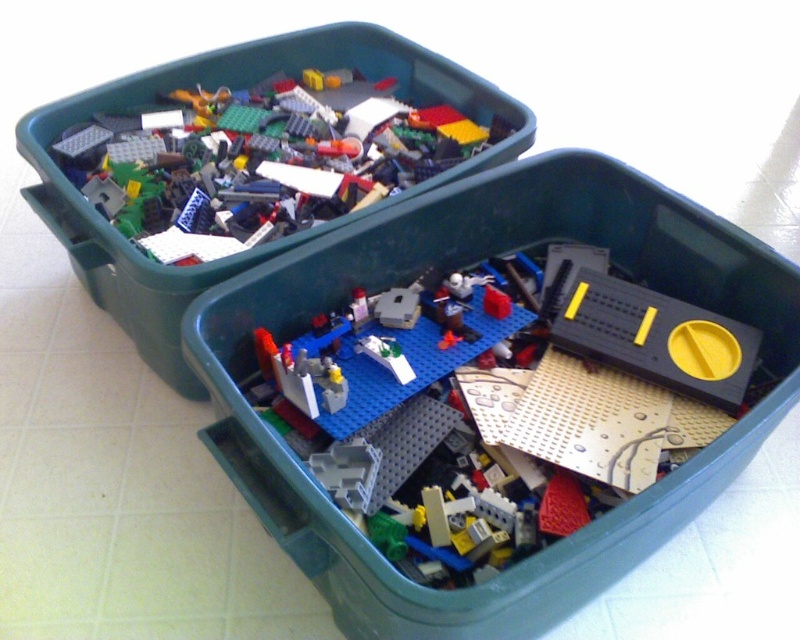
Does blue plastic baseplate at center appear on the left side of matte plastic lego bricks at upper left?

No, blue plastic baseplate at center is not to the left of matte plastic lego bricks at upper left.

This screenshot has width=800, height=640. I want to click on blue plastic baseplate at center, so [x=500, y=408].

Where is `blue plastic baseplate at center`? This screenshot has height=640, width=800. blue plastic baseplate at center is located at coordinates (500, 408).

The height and width of the screenshot is (640, 800). I want to click on blue plastic baseplate at center, so click(500, 408).

Who is more distant from viewer, (x=314, y=115) or (x=440, y=58)?

The point (x=314, y=115) is behind.

From the picture: Who is lower down, translucent plastic bricks at upper left or matte plastic lego bricks at upper left?

Positioned lower is matte plastic lego bricks at upper left.

Is point (380, 154) less distant than point (165, 280)?

No, it is behind (165, 280).

Locate an element on the screen. This screenshot has height=640, width=800. translucent plastic bricks at upper left is located at coordinates (258, 160).

You are a GUI agent. You are given a task and a screenshot of the screen. Output one action in this format:
    pyautogui.click(x=<x>, y=<y>)
    Task: Click on the blue plastic baseplate at center
    The width and height of the screenshot is (800, 640).
    Given the screenshot: What is the action you would take?
    pyautogui.click(x=500, y=408)

Does point (558, 432) lie behind point (272, 224)?

No.

Image resolution: width=800 pixels, height=640 pixels. Find the location of `blue plastic baseplate at center`. blue plastic baseplate at center is located at coordinates (500, 408).